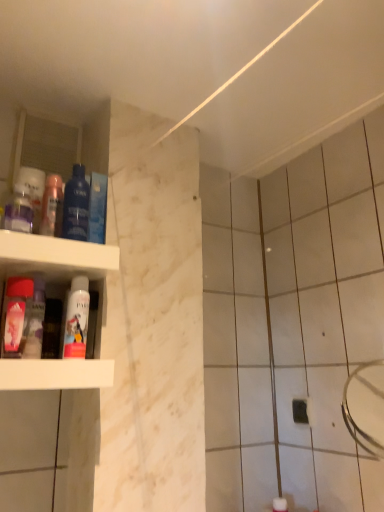
Question: Considering their positions, is pink matte spray can at lower left, acting as the 2th mouthwash starting from the right, located in front of or behind translucent plastic mouthwash at upper left, placed as the fourth mouthwash when sorted from right to left?

Choices:
 (A) behind
 (B) front

Answer: (B)

Question: From their relative heights in the image, would you say pink matte spray can at lower left, acting as the 2th mouthwash starting from the right, is taller or shorter than translucent plastic mouthwash at upper left, placed as the fourth mouthwash when sorted from right to left?

Choices:
 (A) tall
 (B) short

Answer: (A)

Question: Considering the real-world distances, which object is closest to the pink matte spray can at lower left, acting as the 2th mouthwash starting from the right?

Choices:
 (A) blue glossy mouthwash at left, the third mouthwash in the right-to-left sequence
 (B) translucent plastic mouthwash at upper left, the third mouthwash positioned from the left
 (C) matte pink bottle at left
 (D) matte plastic mouthwash at left, the first mouthwash viewed from the left
 (E) white plastic shelf at left

Answer: (C)

Question: Estimate the real-world distances between objects in this image. Which object is closer to the matte pink bottle at left?

Choices:
 (A) blue glossy mouthwash at upper left, which is the 6th mouthwash from left to right
 (B) white plastic shelf at left
 (C) blue glossy mouthwash at left, the third mouthwash in the right-to-left sequence
 (D) translucent plastic mouthwash at upper left, the third mouthwash positioned from the left
 (E) pink matte spray can at lower left, the fifth mouthwash in the left-to-right sequence

Answer: (E)